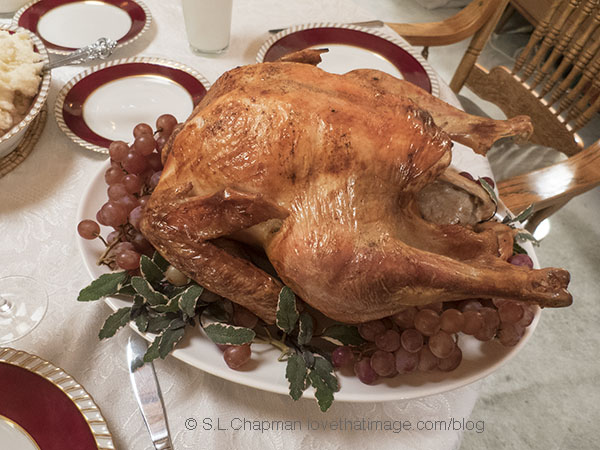
The image size is (600, 450). What are the coordinates of `chair` in the screenshot? It's located at (562, 118).